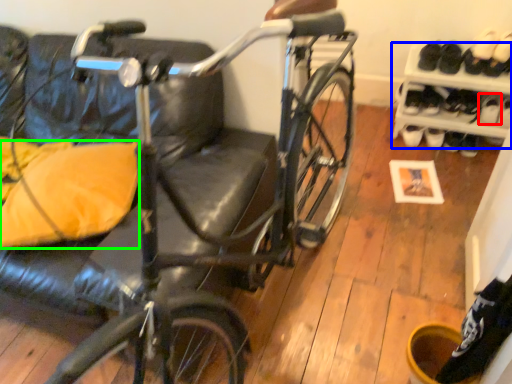
Question: Considering the real-world distances, which object is farthest from shoe (highlighted by a red box)? shelf (highlighted by a blue box) or pillow (highlighted by a green box)?

Choices:
 (A) shelf
 (B) pillow

Answer: (B)